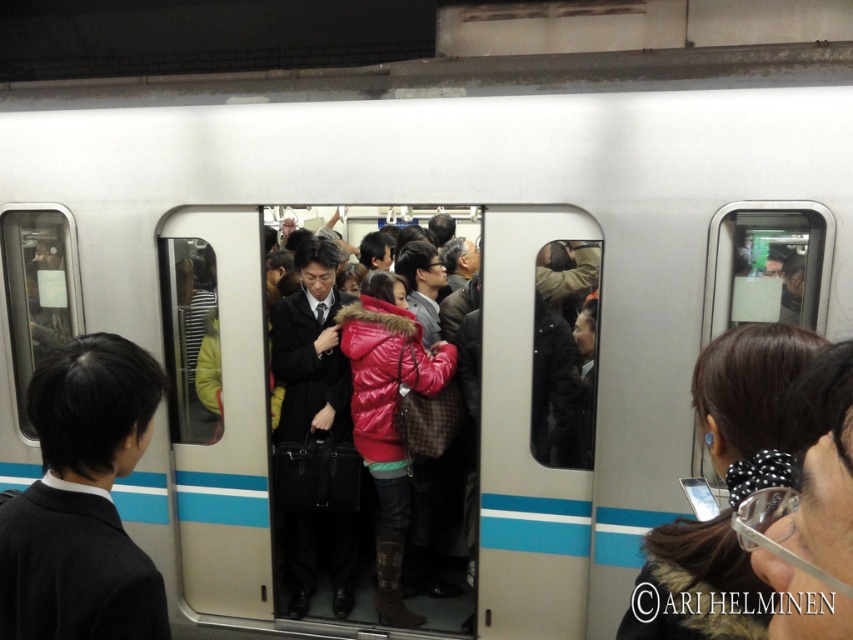
Question: Does shiny black jacket at center appear on the left side of black textured hair at upper right?

Choices:
 (A) no
 (B) yes

Answer: (A)

Question: Which point is farther to the camera?

Choices:
 (A) shiny black jacket at center
 (B) shiny red jacket at center
 (C) black matte sweater at left
 (D) black textured hair at upper right

Answer: (B)

Question: Is black matte sweater at left bigger than shiny black jacket at center?

Choices:
 (A) yes
 (B) no

Answer: (B)

Question: Observing the image, what is the correct spatial positioning of shiny black jacket at center in reference to black textured hair at upper right?

Choices:
 (A) left
 (B) right

Answer: (B)

Question: Which is farther from the black textured hair at upper right?

Choices:
 (A) black matte sweater at left
 (B) shiny red jacket at center

Answer: (B)

Question: Which of these objects is positioned closest to the black textured hair at upper right?

Choices:
 (A) shiny black jacket at center
 (B) black matte sweater at left

Answer: (A)